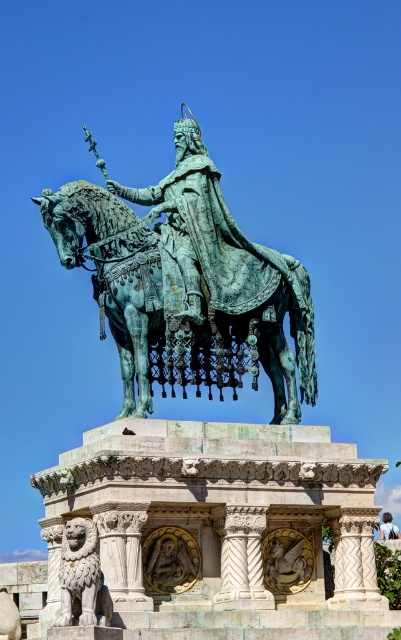
Question: Can you confirm if green patina horse at center is positioned below blue fabric at upper center?

Choices:
 (A) no
 (B) yes

Answer: (A)

Question: Which point appears farthest from the camera in this image?

Choices:
 (A) (89, 621)
 (B) (299, 412)
 (C) (380, 531)

Answer: (C)

Question: In this image, where is green patina horse at center located relative to blue fabric at upper center?

Choices:
 (A) left
 (B) right

Answer: (A)

Question: Which is farther from the green patina horse at center?

Choices:
 (A) stone lion at lower left
 (B) blue fabric at upper center

Answer: (B)

Question: Is stone lion at lower left closer to the viewer compared to blue fabric at upper center?

Choices:
 (A) yes
 (B) no

Answer: (A)

Question: Which object is the closest to the green patina horse at center?

Choices:
 (A) stone lion at lower left
 (B) blue fabric at upper center

Answer: (A)